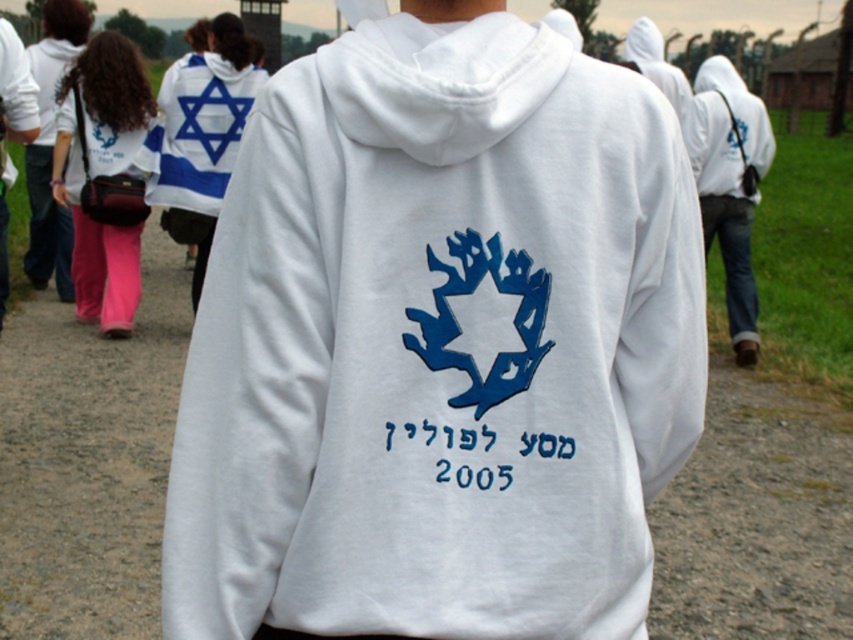
Based on the photo, you are a tour guide explaining the clothing details to visitors. Pointing to the white fabric star of david at upper left and the white fleece hoodie at right, you want to highlight their sizes. Which one is bigger?

The white fabric star of david at upper left is larger in size compared to the white fleece hoodie at right.

You are observing a group of people walking on a gravel path at a historical site. You notice two points marked in the image, one at coordinates point (582, 397) and the other at point (689, 113). Which of these two points is nearer to your viewpoint?

Point (582, 397) is closer to the camera than point (689, 113), so the point at coordinates point (582, 397) is nearer to your viewpoint.

You are a tour guide explaining the historical significance of the clothing in the image. You notice the white fabric star of david at upper left and the matte white hoodie at left. Which of these two items has a larger height?

The white fabric star of david at upper left has a greater height compared to the matte white hoodie at left.